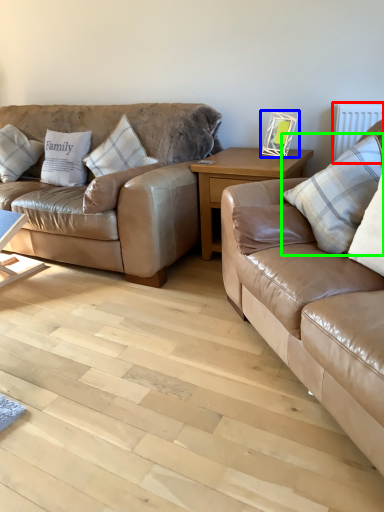
Question: Considering the real-world distances, which object is closest to radiator (highlighted by a red box)? picture frame (highlighted by a blue box) or pillow (highlighted by a green box).

Choices:
 (A) picture frame
 (B) pillow

Answer: (A)